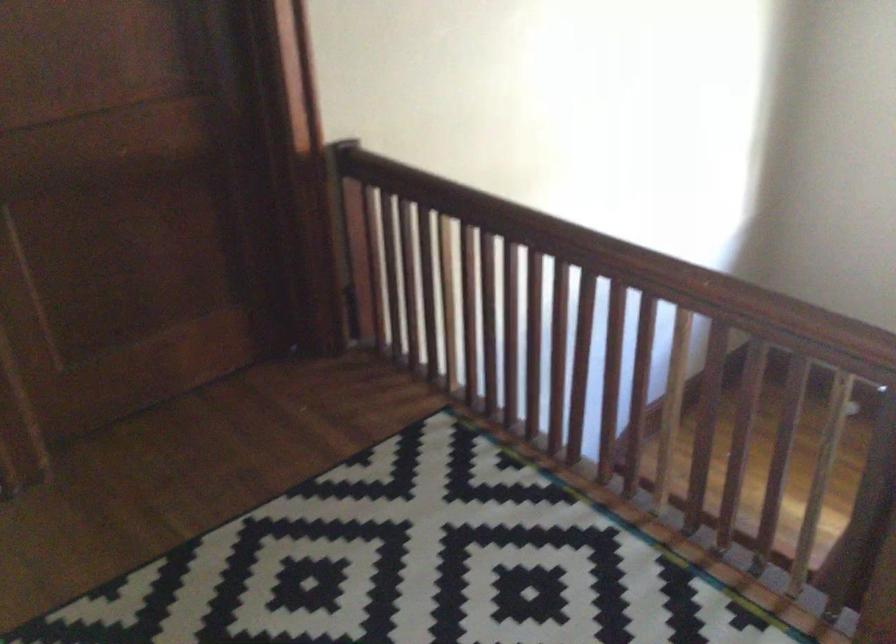
Question: The first image is from the beginning of the video and the second image is from the end. How did the camera likely rotate when shooting the video?

Choices:
 (A) Left
 (B) Right
 (C) Up
 (D) Down

Answer: (A)